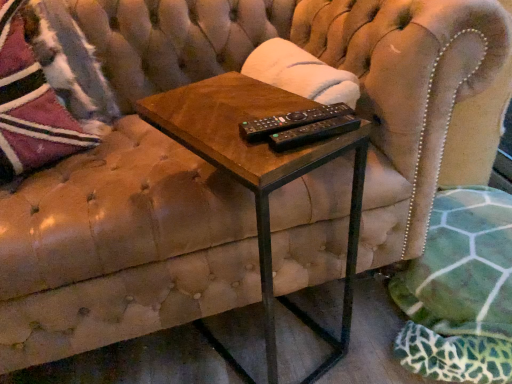
Where is `free space to the left of black plastic remote controls at center`? Image resolution: width=512 pixels, height=384 pixels. free space to the left of black plastic remote controls at center is located at coordinates (211, 122).